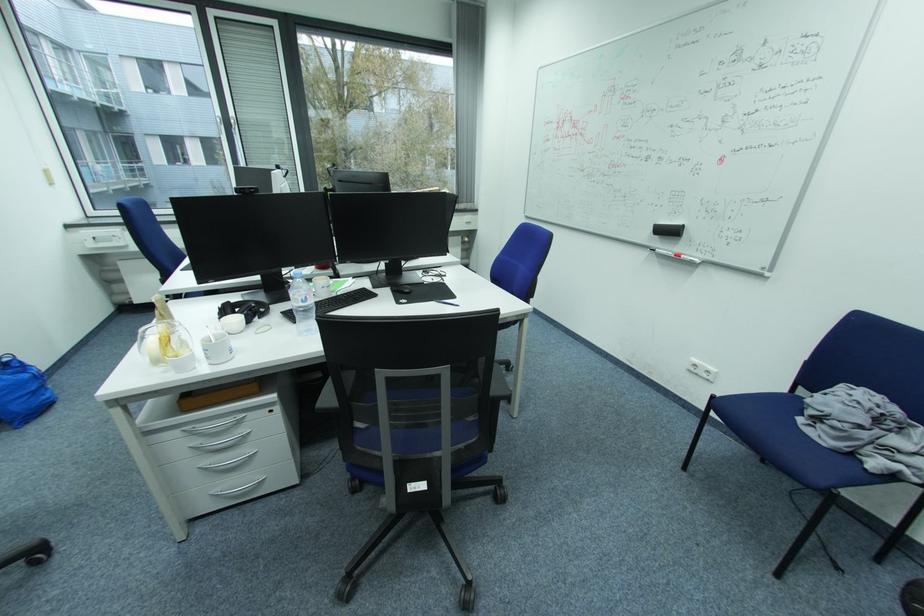
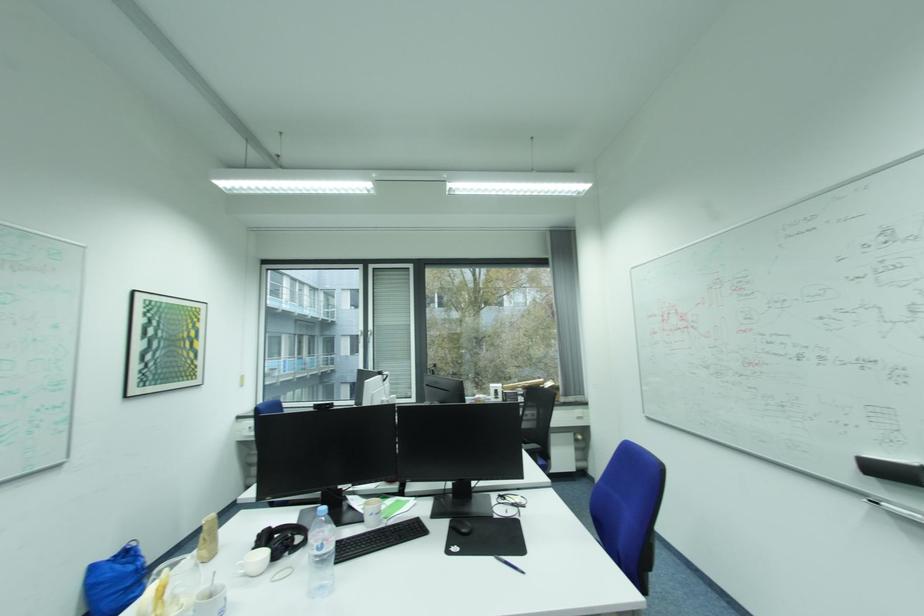
Find the pixel in the second image that matches (x=310, y=301) in the first image.

(323, 549)